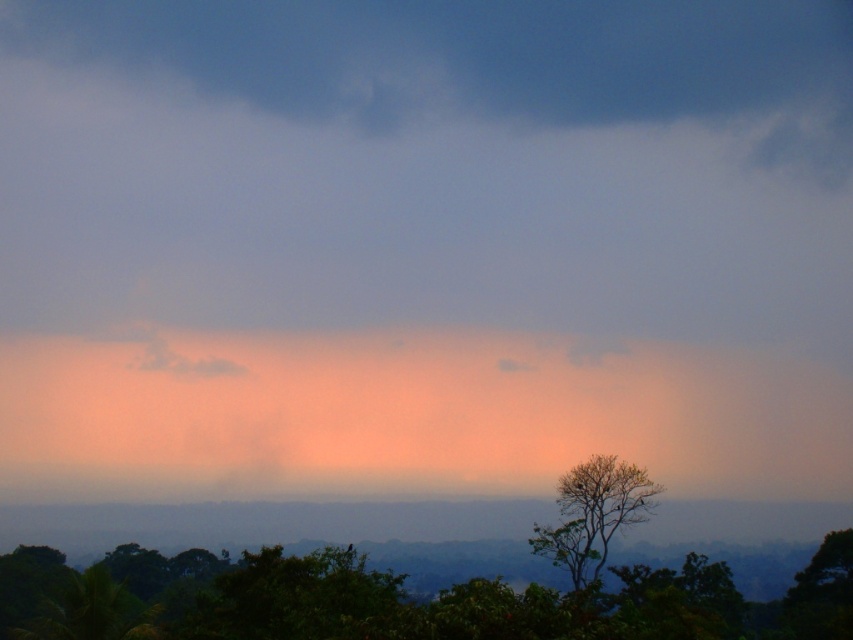
Question: Is green leafy tree at lower center bigger than green leafy tree at lower right?

Choices:
 (A) no
 (B) yes

Answer: (B)

Question: Does green leafy tree at lower center appear over green leafy tree at lower right?

Choices:
 (A) yes
 (B) no

Answer: (B)

Question: Among these objects, which one is nearest to the camera?

Choices:
 (A) green leafy tree at lower center
 (B) green leafy tree at lower right

Answer: (A)

Question: From the image, what is the correct spatial relationship of green leafy tree at lower center in relation to green leafy tree at lower right?

Choices:
 (A) below
 (B) above

Answer: (A)

Question: Which of the following is the closest to the observer?

Choices:
 (A) green leafy tree at lower right
 (B) green leafy tree at lower center

Answer: (B)